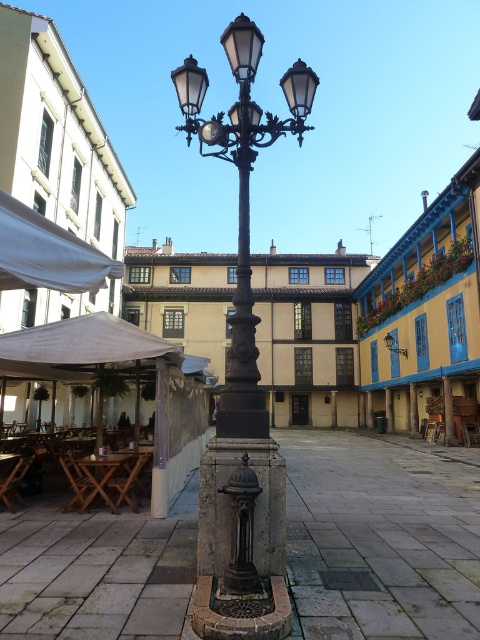
You are standing in the urban square and want to take a photo of the white fabric canopy at upper left. If your camera has a maximum focus range of 10 feet, will you need to move closer to capture it clearly?

The white fabric canopy at upper left is 11.00 feet away from the camera, which exceeds the maximum focus range of 10 feet. Therefore, you need to move closer to ensure it is in focus.

You are standing in the urban square and want to reach the point marked as point (4,264). If you can walk 3 feet per second, how many seconds will it take you to reach that point?

The distance between you and point (4,264) is 11.17 feet. At a walking speed of 3 feet per second, it will take approximately 3.72 seconds to reach the point.